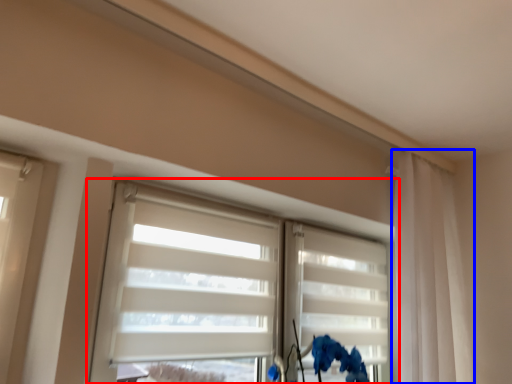
Question: Which object appears farthest to the camera in this image, window (highlighted by a red box) or curtain (highlighted by a blue box)?

Choices:
 (A) window
 (B) curtain

Answer: (B)